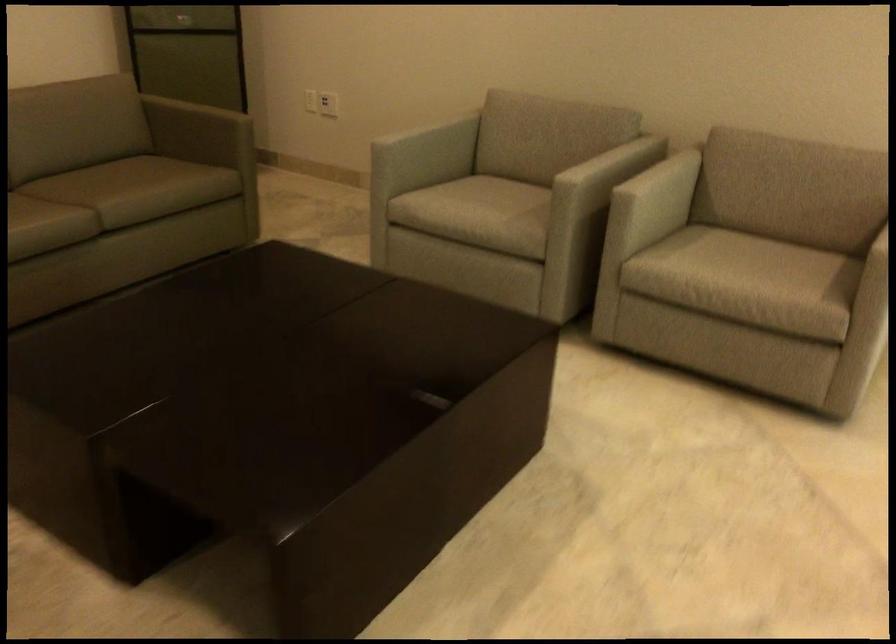
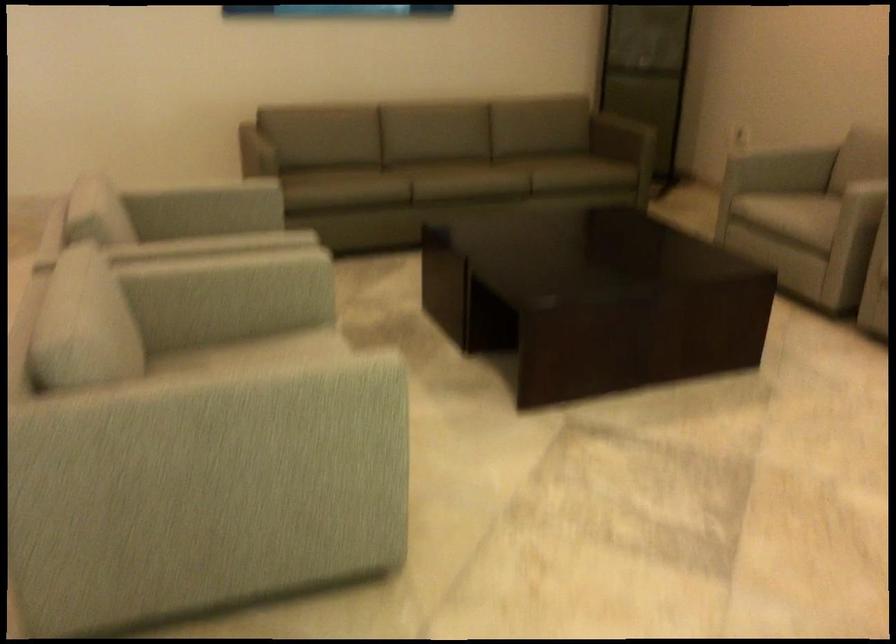
Locate, in the second image, the point that corresponds to point 227,114 in the first image.

(648, 140)